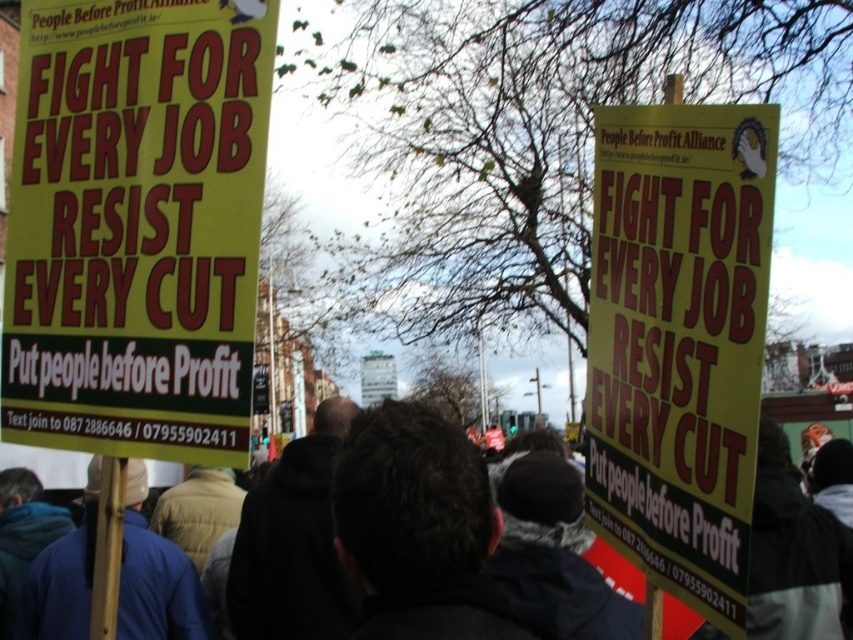
Question: Which object appears closest to the camera in this image?

Choices:
 (A) yellow paper sign at center
 (B) yellow paper sign at left

Answer: (A)

Question: From the image, what is the correct spatial relationship of yellow paper sign at left in relation to yellow paper sign at center?

Choices:
 (A) left
 (B) right

Answer: (A)

Question: Does yellow paper sign at left appear over yellow paper sign at center?

Choices:
 (A) yes
 (B) no

Answer: (A)

Question: Does yellow paper sign at left appear on the right side of yellow paper sign at center?

Choices:
 (A) no
 (B) yes

Answer: (A)